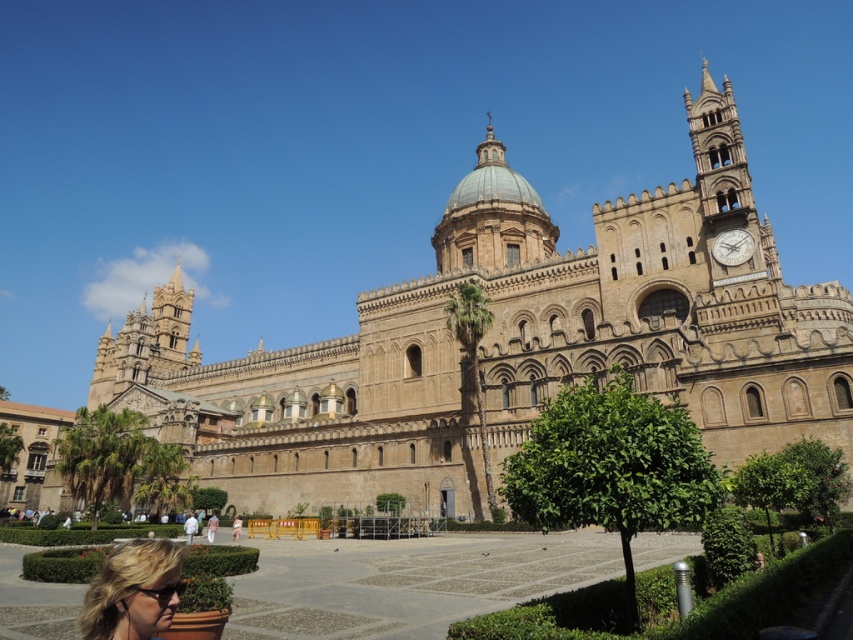
Question: Which object appears closest to the camera in this image?

Choices:
 (A) metallic silver clock at upper right
 (B) pink fabric dress at lower center
 (C) white cotton shirt at lower center
 (D) brown stone church at center

Answer: (D)

Question: Which object appears closest to the camera in this image?

Choices:
 (A) metallic silver clock at upper right
 (B) brown stone church at center
 (C) blonde hair at lower left
 (D) pink fabric dress at lower center

Answer: (C)

Question: Among these objects, which one is nearest to the camera?

Choices:
 (A) metallic silver clock at upper right
 (B) white cotton shirt at lower center
 (C) brown stone church at center

Answer: (C)

Question: Can you confirm if blonde hair at lower left is thinner than metallic silver clock at upper right?

Choices:
 (A) yes
 (B) no

Answer: (B)

Question: Is metallic silver clock at upper right further to camera compared to pink fabric dress at lower center?

Choices:
 (A) no
 (B) yes

Answer: (A)

Question: Can you confirm if brown stone church at center is smaller than pink fabric dress at lower center?

Choices:
 (A) yes
 (B) no

Answer: (B)